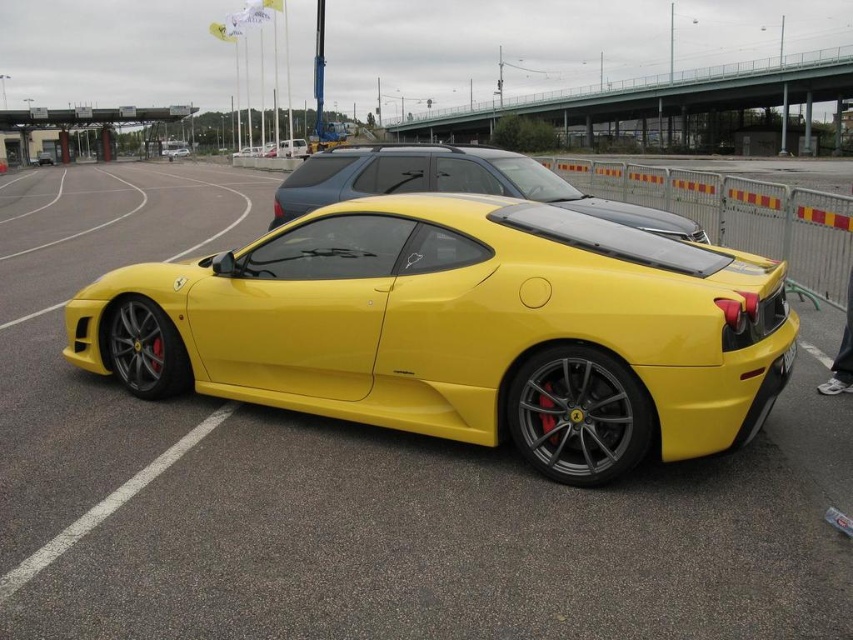
Question: Does yellow matte/satin car at center lie in front of yellow matte license plate at center?

Choices:
 (A) yes
 (B) no

Answer: (B)

Question: Is matte yellow sports car at center thinner than yellow matte/satin car at center?

Choices:
 (A) yes
 (B) no

Answer: (A)

Question: Is matte yellow sports car at center thinner than matte white van at center?

Choices:
 (A) yes
 (B) no

Answer: (A)

Question: Which object is farther from the camera taking this photo?

Choices:
 (A) matte white van at center
 (B) matte yellow sports car at center
 (C) yellow matte/satin car at center
 (D) yellow matte license plate at center

Answer: (A)

Question: Which of the following is the farthest from the observer?

Choices:
 (A) (274, 330)
 (B) (788, 372)
 (C) (308, 166)

Answer: (C)

Question: Which of the following is the farthest from the observer?

Choices:
 (A) matte yellow sports car at center
 (B) yellow matte license plate at center
 (C) matte white van at center

Answer: (C)